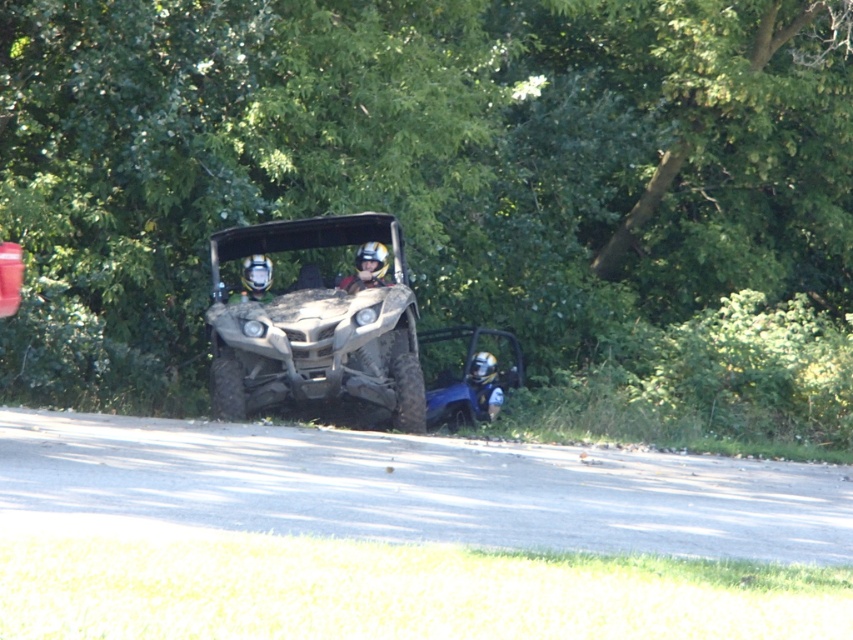
Question: Can you confirm if dirty matte utv at center is positioned above matte yellow helmet at center?

Choices:
 (A) no
 (B) yes

Answer: (A)

Question: Which of these objects is positioned closest to the matte yellow helmet at center?

Choices:
 (A) matte black helmet at center
 (B) green leafy tree at center

Answer: (A)

Question: Which is nearer to the blue metallic helmet at lower right?

Choices:
 (A) matte black helmet at center
 (B) matte yellow helmet at center
 (C) dirty matte utv at center

Answer: (B)

Question: Does green leafy tree at center appear on the right side of dirty matte utv at center?

Choices:
 (A) no
 (B) yes

Answer: (B)

Question: Considering the relative positions of matte yellow helmet at center and matte black helmet at center in the image provided, where is matte yellow helmet at center located with respect to matte black helmet at center?

Choices:
 (A) below
 (B) above

Answer: (A)

Question: Which point is closer to the camera?

Choices:
 (A) blue metallic helmet at lower right
 (B) matte yellow helmet at center
 (C) dirty matte utv at center
 (D) green leafy tree at center

Answer: (C)